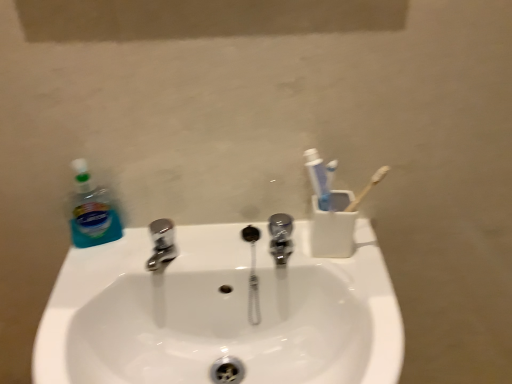
Find the location of `vacant space that is to the left of white plastic toothbrush holder at upper right`. vacant space that is to the left of white plastic toothbrush holder at upper right is located at coordinates (x=236, y=244).